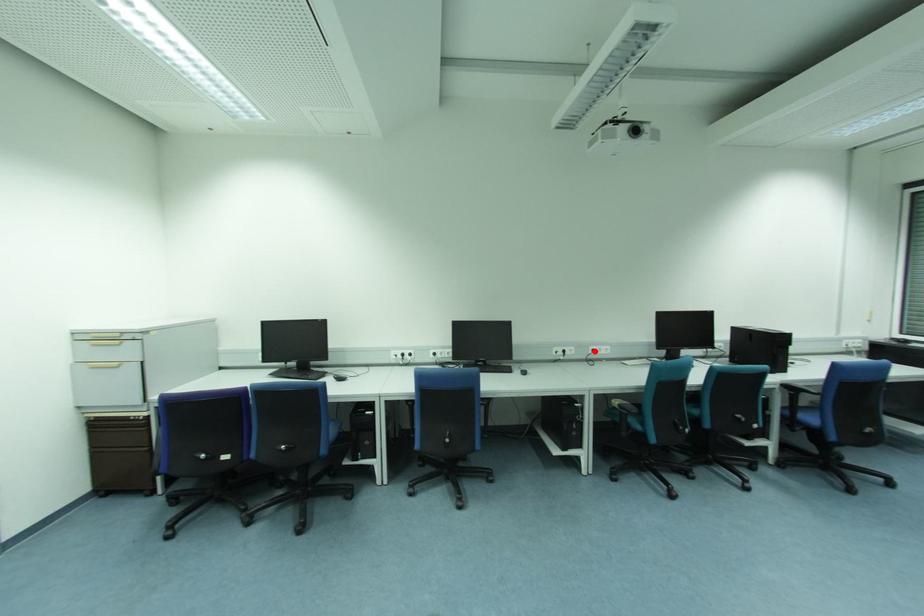
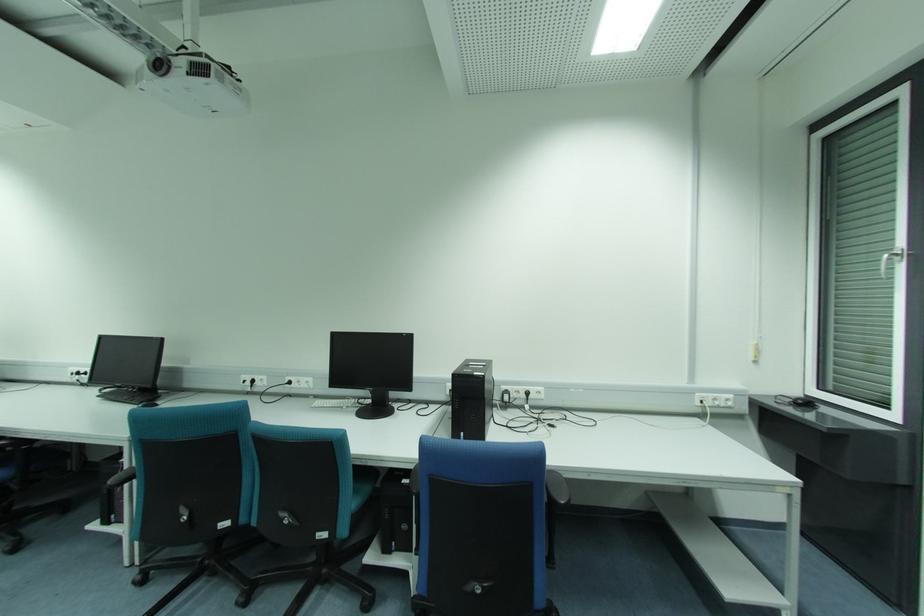
Locate, in the second image, the point that corresponds to the highlighted location in the first image.

(289, 383)